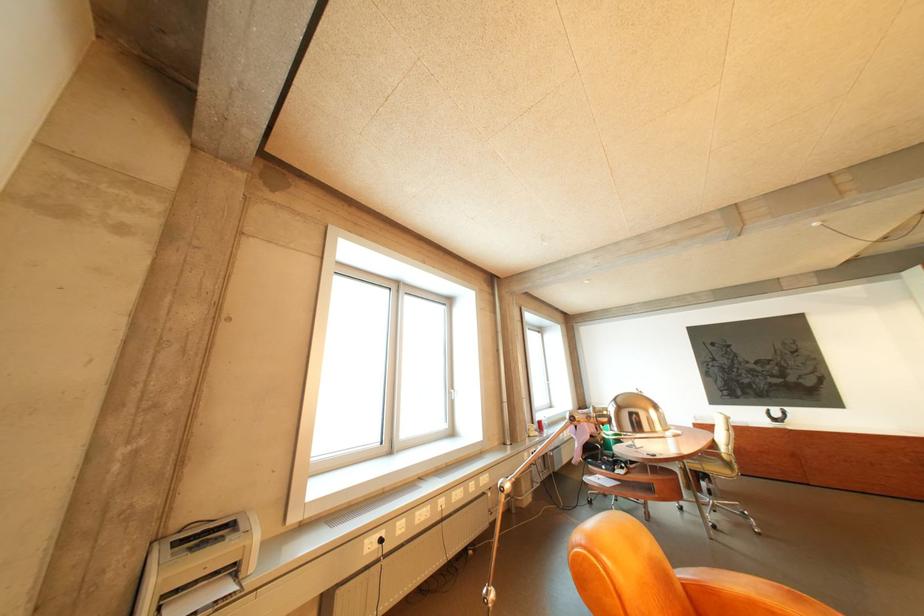
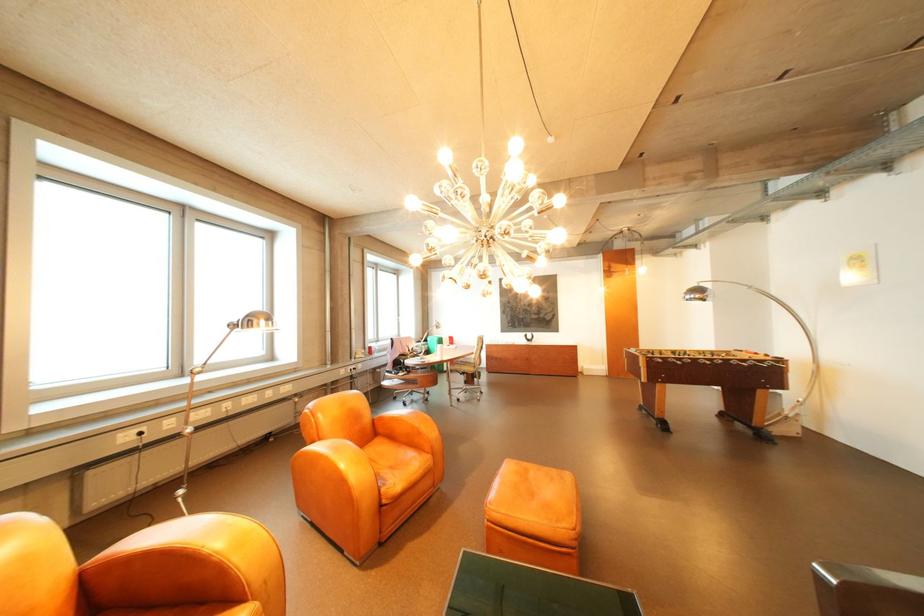
The images are taken continuously from a first-person perspective. In which direction are you moving?

The cameraman moved toward right, backward.